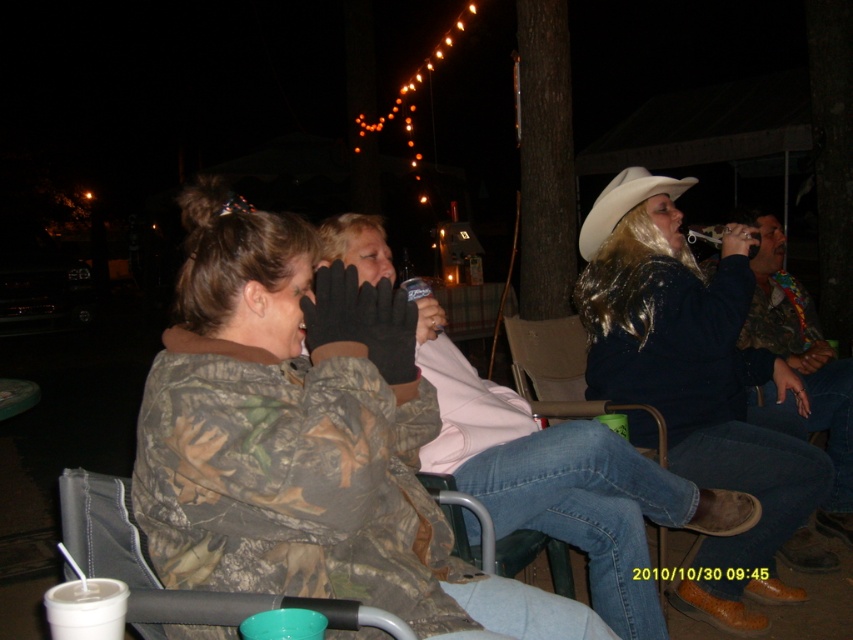
Question: Is camo-patterned jacket at center to the left of camouflage jacket at right from the viewer's perspective?

Choices:
 (A) no
 (B) yes

Answer: (B)

Question: Which of the following is the closest to the observer?

Choices:
 (A) camo-patterned jacket at center
 (B) white styrofoam cup at lower left
 (C) camouflage jacket at center

Answer: (B)

Question: Which point is farther to the camera?

Choices:
 (A) (582, 256)
 (B) (62, 614)
 (C) (227, 429)

Answer: (A)

Question: Can you confirm if camo-patterned jacket at center is wider than light pink fleece jacket at center?

Choices:
 (A) no
 (B) yes

Answer: (A)

Question: Estimate the real-world distances between objects in this image. Which object is farther from the white matte cowboy hat at upper right?

Choices:
 (A) white styrofoam cup at lower left
 (B) light pink fleece jacket at center
 (C) camouflage jacket at right
 (D) camo-patterned jacket at center

Answer: (A)

Question: Where is camouflage jacket at right located in relation to white styrofoam cup at lower left in the image?

Choices:
 (A) below
 (B) above

Answer: (B)